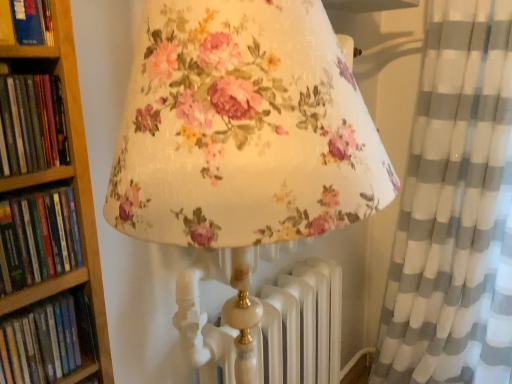
Question: In terms of width, does hardcover book at upper left, placed as the 1th book when sorted from top to bottom, look wider or thinner when compared to hardcover book at left, the second book positioned from the bottom?

Choices:
 (A) wide
 (B) thin

Answer: (A)

Question: Considering the positions of hardcover book at upper left, which appears as the 4th book when ordered from the bottom, and hardcover book at left, the second book positioned from the bottom, in the image, is hardcover book at upper left, which appears as the 4th book when ordered from the bottom, taller or shorter than hardcover book at left, the second book positioned from the bottom,?

Choices:
 (A) tall
 (B) short

Answer: (A)

Question: Estimate the real-world distances between objects in this image. Which object is farther from the white/grey striped curtain at right?

Choices:
 (A) hardcover book at upper left, placed as the 1th book when sorted from top to bottom
 (B) hardcover book at left, the 1th book in the bottom-to-top sequence
 (C) green matte book at left, arranged as the second book when viewed from the top
 (D) hardcover book at left, the second book positioned from the bottom

Answer: (A)

Question: Which is nearer to the hardcover book at left, the second book positioned from the bottom?

Choices:
 (A) green matte book at left, arranged as the second book when viewed from the top
 (B) white/grey striped curtain at right
 (C) hardcover book at left, arranged as the 4th book when viewed from the top
 (D) hardcover book at upper left, which appears as the 4th book when ordered from the bottom

Answer: (A)